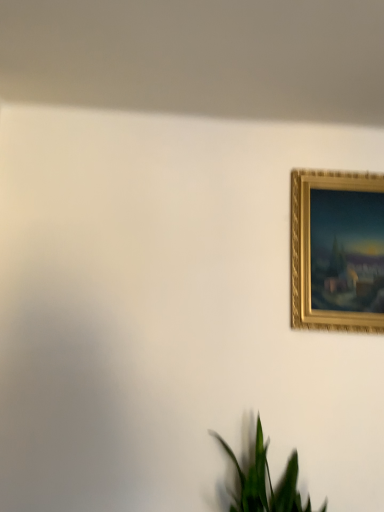
Question: From the image's perspective, relative to gold textured picture frame at upper right, is green leafy plant at lower center above or below?

Choices:
 (A) below
 (B) above

Answer: (A)

Question: Is green leafy plant at lower center situated inside gold textured picture frame at upper right or outside?

Choices:
 (A) inside
 (B) outside

Answer: (B)

Question: From a real-world perspective, is green leafy plant at lower center physically located above or below gold textured picture frame at upper right?

Choices:
 (A) above
 (B) below

Answer: (B)

Question: Looking at the image, does gold textured picture frame at upper right seem bigger or smaller compared to green leafy plant at lower center?

Choices:
 (A) small
 (B) big

Answer: (A)

Question: Considering the positions of point (291, 173) and point (221, 441), is point (291, 173) closer or farther from the camera than point (221, 441)?

Choices:
 (A) closer
 (B) farther

Answer: (B)

Question: Based on their positions, is gold textured picture frame at upper right located to the left or right of green leafy plant at lower center?

Choices:
 (A) right
 (B) left

Answer: (A)

Question: Is gold textured picture frame at upper right inside the boundaries of green leafy plant at lower center, or outside?

Choices:
 (A) inside
 (B) outside

Answer: (B)